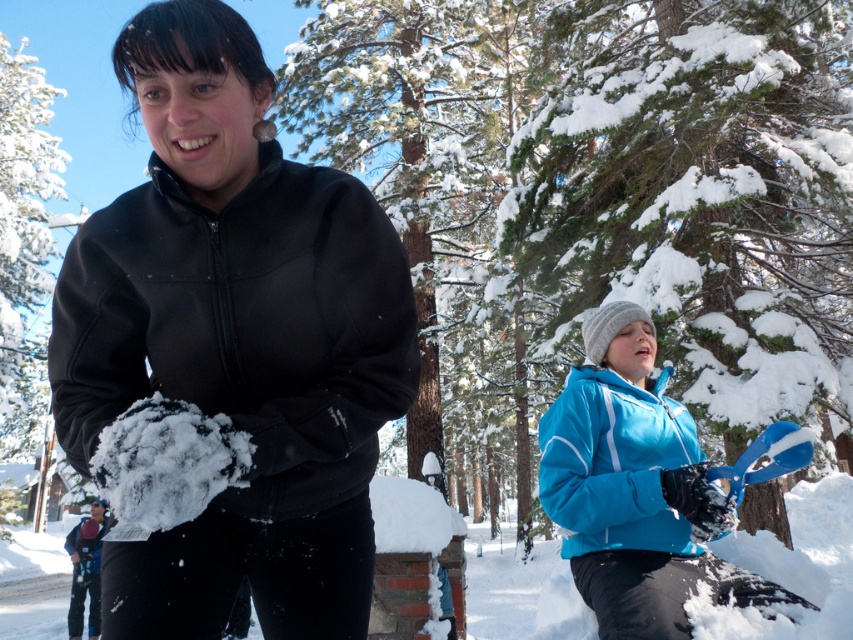
Question: Considering the real-world distances, which object is farthest from the green textured pine tree at center?

Choices:
 (A) matte black jacket at center
 (B) blue matte jacket at lower right

Answer: (A)

Question: Can you confirm if green textured pine tree at center is positioned to the right of blue matte jacket at lower right?

Choices:
 (A) yes
 (B) no

Answer: (A)

Question: Is the position of matte black jacket at center more distant than that of blue matte jacket at lower right?

Choices:
 (A) yes
 (B) no

Answer: (B)

Question: Can you confirm if matte black jacket at center is bigger than blue matte jacket at lower right?

Choices:
 (A) no
 (B) yes

Answer: (A)

Question: Which of the following is the closest to the observer?

Choices:
 (A) (834, 392)
 (B) (207, 477)

Answer: (B)

Question: Which of the following is the closest to the observer?

Choices:
 (A) blue matte jacket at lower right
 (B) matte black jacket at center

Answer: (B)